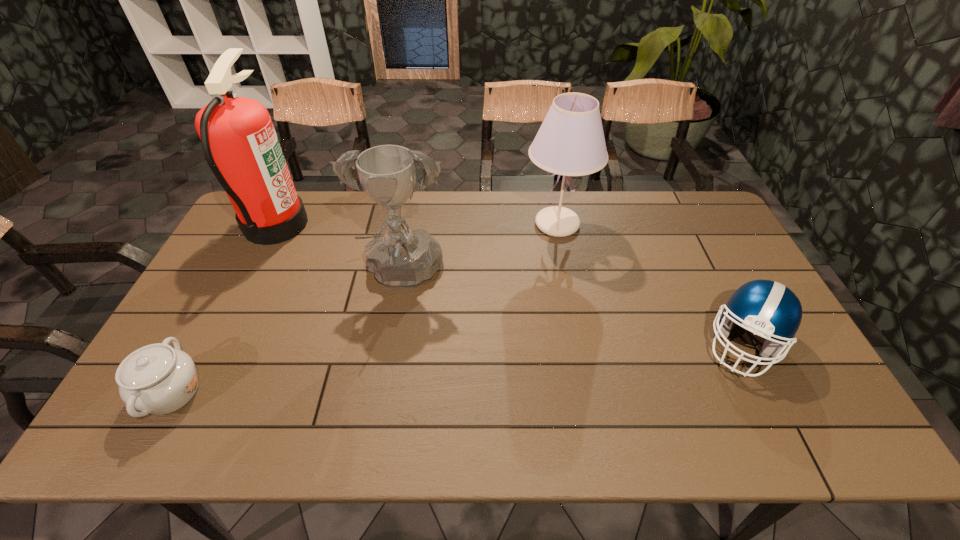
Image resolution: width=960 pixels, height=540 pixels. I want to click on vacant point located between the football helmet and the chinaware, so click(458, 368).

Where is `vacant area that lies between the third object from right to left and the tallest object`? This screenshot has width=960, height=540. vacant area that lies between the third object from right to left and the tallest object is located at coordinates (339, 251).

At what (x,y) coordinates should I click in order to perform the action: click on free space between the fire extinguisher and the second object from right to left. Please return your answer as a coordinate pair (x, y). The width and height of the screenshot is (960, 540). Looking at the image, I should click on (417, 224).

The height and width of the screenshot is (540, 960). I want to click on free space between the fire extinguisher and the third object from left to right, so click(x=339, y=251).

Identify which object is located as the third nearest to the fire extinguisher. Please provide its 2D coordinates. Your answer should be formatted as a tuple, i.e. [(x, y)], where the tuple contains the x and y coordinates of a point satisfying the conditions above.

[(570, 142)]

Point out which object is positioned as the fourth nearest to the shortest object. Please provide its 2D coordinates. Your answer should be formatted as a tuple, i.e. [(x, y)], where the tuple contains the x and y coordinates of a point satisfying the conditions above.

[(766, 308)]

Identify the location of free space that satisfies the following two spatial constraints: 1. at the nozzle of the tallest object; 2. on the right side of the lampshade. The image size is (960, 540). (276, 224).

You are a GUI agent. You are given a task and a screenshot of the screen. Output one action in this format:
    pyautogui.click(x=<x>, y=<y>)
    Task: Click on the vacant position in the image that satisfies the following two spatial constraints: 1. at the nozzle of the fire extinguisher; 2. on the right side of the second object from right to left
    This screenshot has height=540, width=960.
    Given the screenshot: What is the action you would take?
    pyautogui.click(x=276, y=224)

Where is `vacant region that satisfies the following two spatial constraints: 1. on the back side of the lampshade; 2. at the nozzle of the tallest object`? vacant region that satisfies the following two spatial constraints: 1. on the back side of the lampshade; 2. at the nozzle of the tallest object is located at coordinates (557, 224).